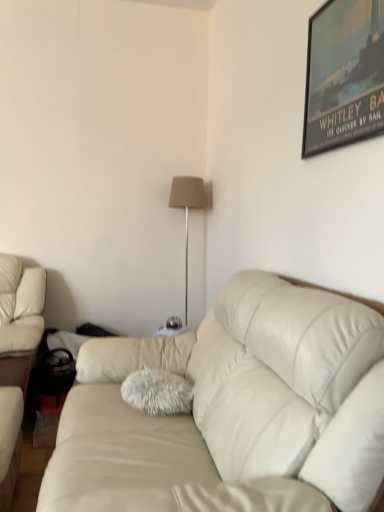
Question: Considering the positions of leather couch at center and beige fabric lampshade at center in the image, is leather couch at center wider or thinner than beige fabric lampshade at center?

Choices:
 (A) wide
 (B) thin

Answer: (A)

Question: Is leather couch at center taller or shorter than beige fabric lampshade at center?

Choices:
 (A) tall
 (B) short

Answer: (B)

Question: Which object is the closest to the metallic poster at upper right?

Choices:
 (A) leather couch at center
 (B) fuzzy teal throw pillow at center
 (C) beige fabric lampshade at center

Answer: (A)

Question: Estimate the real-world distances between objects in this image. Which object is farther from the metallic poster at upper right?

Choices:
 (A) leather couch at center
 (B) fuzzy teal throw pillow at center
 (C) beige fabric lampshade at center

Answer: (C)